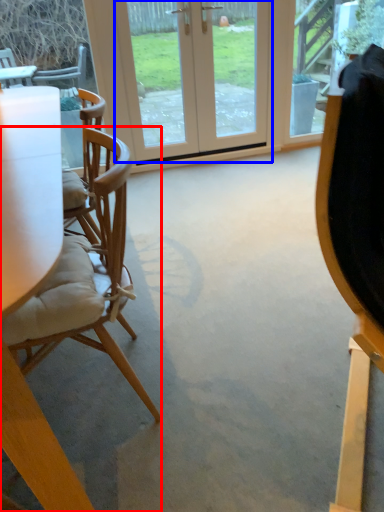
Question: Which object is closer to the camera taking this photo, chair (highlighted by a red box) or door (highlighted by a blue box)?

Choices:
 (A) chair
 (B) door

Answer: (A)